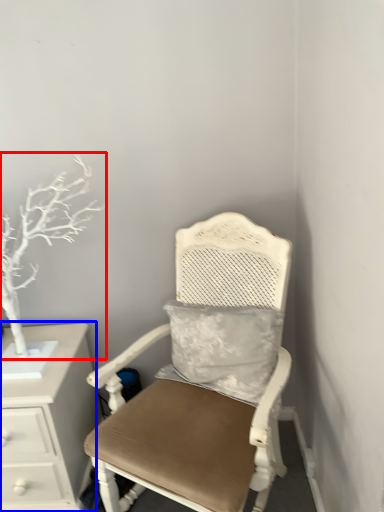
Question: Which point is further to the camera, tree (highlighted by a red box) or chest of drawers (highlighted by a blue box)?

Choices:
 (A) tree
 (B) chest of drawers

Answer: (B)